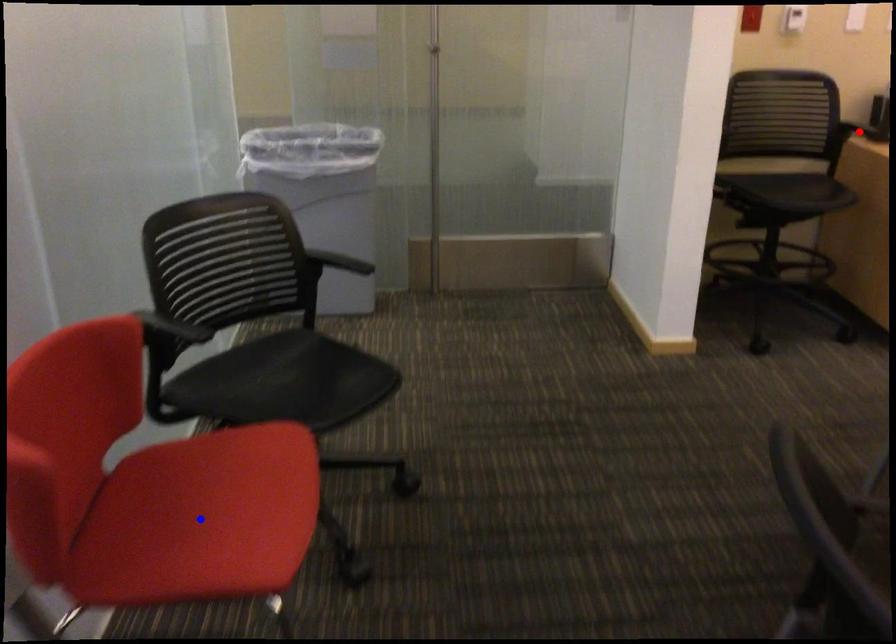
Question: Which of the two points in the image is closer to the camera?

Choices:
 (A) Blue point is closer.
 (B) Red point is closer.

Answer: (A)